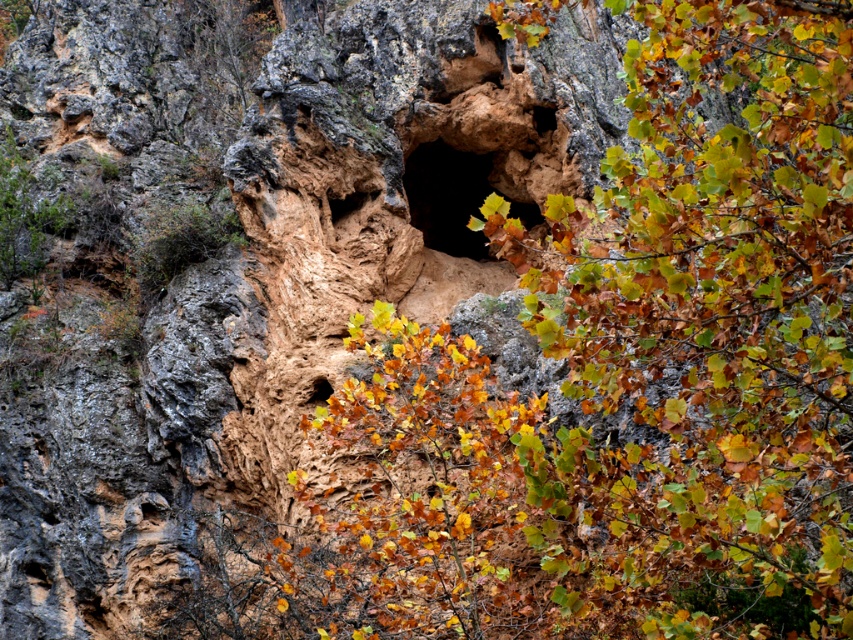
Question: Which point is closer to the camera?

Choices:
 (A) dark rock hole at center
 (B) brown rough hole at center

Answer: (B)

Question: Can you confirm if dark rock hole at center is positioned to the right of brown rough hole at center?

Choices:
 (A) no
 (B) yes

Answer: (B)

Question: Which object is closer to the camera taking this photo?

Choices:
 (A) dark rock hole at center
 (B) brown rough hole at center

Answer: (B)

Question: Is dark rock hole at center smaller than brown rough hole at center?

Choices:
 (A) no
 (B) yes

Answer: (A)

Question: Is dark rock hole at center thinner than brown rough hole at center?

Choices:
 (A) yes
 (B) no

Answer: (A)